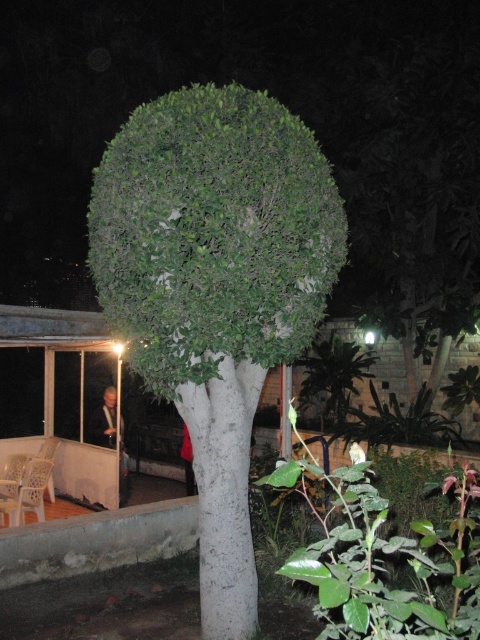
Question: Can you confirm if green leafy tree at center is positioned to the left of white plastic chair at lower left?

Choices:
 (A) yes
 (B) no

Answer: (B)

Question: Is green leafy tree at center further to camera compared to white plastic chair at lower left?

Choices:
 (A) no
 (B) yes

Answer: (A)

Question: Is green leafy tree at center thinner than white plastic chair at lower left?

Choices:
 (A) yes
 (B) no

Answer: (B)

Question: Which point is closer to the camera taking this photo?

Choices:
 (A) (190, 337)
 (B) (22, 484)

Answer: (A)